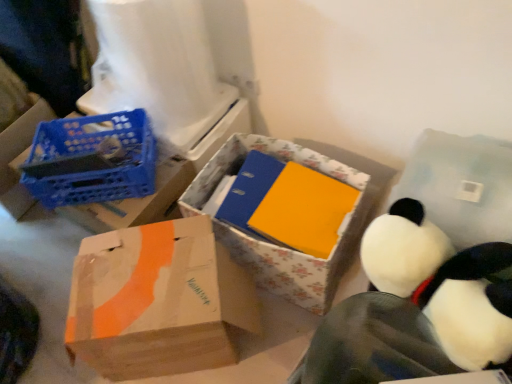
Question: Is white plush toy at upper right positioned beyond the bounds of brown cardboard box at lower left, positioned as the second box in left-to-right order?

Choices:
 (A) yes
 (B) no

Answer: (A)

Question: Considering the relative sizes of white plush toy at upper right and brown cardboard box at lower left, positioned as the second box in left-to-right order, in the image provided, is white plush toy at upper right shorter than brown cardboard box at lower left, positioned as the second box in left-to-right order,?

Choices:
 (A) yes
 (B) no

Answer: (A)

Question: From a real-world perspective, does white plush toy at upper right sit lower than brown cardboard box at lower left, positioned as the second box in left-to-right order?

Choices:
 (A) no
 (B) yes

Answer: (A)

Question: Is white plush toy at upper right in front of brown cardboard box at lower left, positioned as the second box in left-to-right order?

Choices:
 (A) no
 (B) yes

Answer: (B)

Question: From the image's perspective, is white plush toy at upper right on top of brown cardboard box at lower left, positioned as the second box in left-to-right order?

Choices:
 (A) no
 (B) yes

Answer: (B)

Question: In the image, is blue plastic crate at left, the 1th box in the left-to-right sequence, on the left side or the right side of white plastic toilet paper at upper left?

Choices:
 (A) right
 (B) left

Answer: (B)

Question: From a real-world perspective, is blue plastic crate at left, the 1th box in the left-to-right sequence, positioned above or below white plastic toilet paper at upper left?

Choices:
 (A) below
 (B) above

Answer: (A)

Question: Considering their positions, is blue plastic crate at left, the third box when ordered from right to left, located in front of or behind white plastic toilet paper at upper left?

Choices:
 (A) front
 (B) behind

Answer: (B)

Question: From the image's perspective, is blue plastic crate at left, the 1th box in the left-to-right sequence, located above or below white plastic toilet paper at upper left?

Choices:
 (A) below
 (B) above

Answer: (A)

Question: In terms of height, does white plush penguin at lower right look taller or shorter compared to floral cardboard box at center, which is the first box in right-to-left order?

Choices:
 (A) tall
 (B) short

Answer: (A)

Question: From a real-world perspective, is white plush penguin at lower right positioned above or below floral cardboard box at center, which is the first box in right-to-left order?

Choices:
 (A) above
 (B) below

Answer: (A)

Question: Considering the positions of point (404, 334) and point (300, 266), is point (404, 334) closer or farther from the camera than point (300, 266)?

Choices:
 (A) farther
 (B) closer

Answer: (B)

Question: From the image's perspective, relative to floral cardboard box at center, which is the third box from left to right, is white plush penguin at lower right above or below?

Choices:
 (A) above
 (B) below

Answer: (B)

Question: Considering the positions of blue plastic crate at left, the third box when ordered from right to left, and floral cardboard box at center, which is the first box in right-to-left order, in the image, is blue plastic crate at left, the third box when ordered from right to left, bigger or smaller than floral cardboard box at center, which is the first box in right-to-left order,?

Choices:
 (A) small
 (B) big

Answer: (B)

Question: Considering the positions of blue plastic crate at left, the 1th box in the left-to-right sequence, and floral cardboard box at center, which is the first box in right-to-left order, in the image, is blue plastic crate at left, the 1th box in the left-to-right sequence, taller or shorter than floral cardboard box at center, which is the first box in right-to-left order,?

Choices:
 (A) tall
 (B) short

Answer: (A)